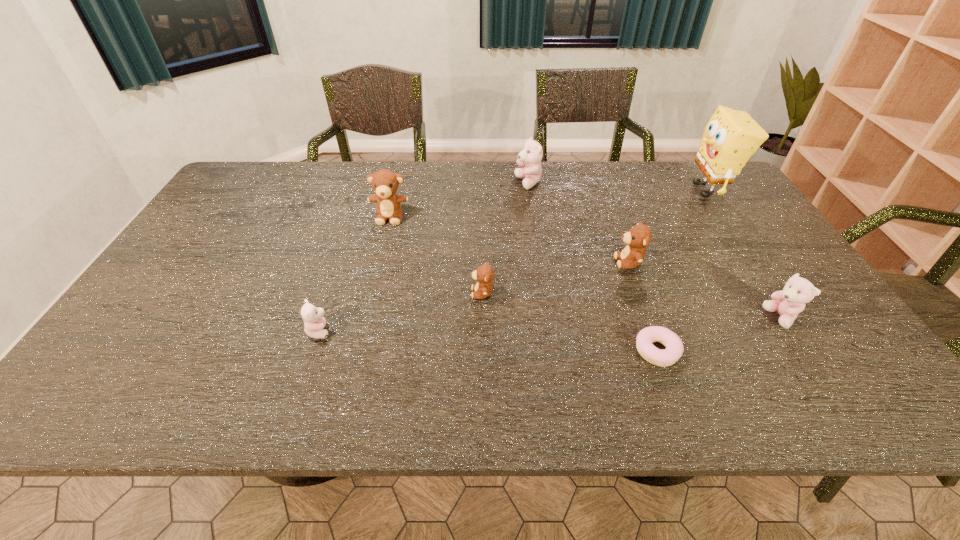
Where is `free area in between the fifth teddy bear from left to right and the shortest object`? The image size is (960, 540). free area in between the fifth teddy bear from left to right and the shortest object is located at coordinates (643, 307).

The height and width of the screenshot is (540, 960). I want to click on empty space that is in between the farthest teddy bear and the nearest brown teddy bear, so click(505, 238).

The width and height of the screenshot is (960, 540). What are the coordinates of `object that is the closest to the third farthest object` in the screenshot? It's located at (484, 274).

You are a GUI agent. You are given a task and a screenshot of the screen. Output one action in this format:
    pyautogui.click(x=<x>, y=<y>)
    Task: Click on the object that is the fourth closest to the shortest object
    
    Given the screenshot: What is the action you would take?
    pyautogui.click(x=731, y=137)

Where is `teddy bear that is the second closest to the shortest object`? The image size is (960, 540). teddy bear that is the second closest to the shortest object is located at coordinates (x=788, y=303).

Locate an element on the screen. This screenshot has height=540, width=960. teddy bear identified as the fifth closest to the pink doughnut is located at coordinates (314, 322).

Identify the location of pink teddy bear that is the second closest to the second smallest pink teddy bear. This screenshot has height=540, width=960. (314, 322).

I want to click on the second closest pink teddy bear relative to the leftmost object, so click(788, 303).

Find the location of `the second closest brown teddy bear to the fourth farthest object`. the second closest brown teddy bear to the fourth farthest object is located at coordinates click(385, 183).

Point out which brown teddy bear is positioned as the nearest to the sponge. Please provide its 2D coordinates. Your answer should be formatted as a tuple, i.e. [(x, y)], where the tuple contains the x and y coordinates of a point satisfying the conditions above.

[(639, 236)]